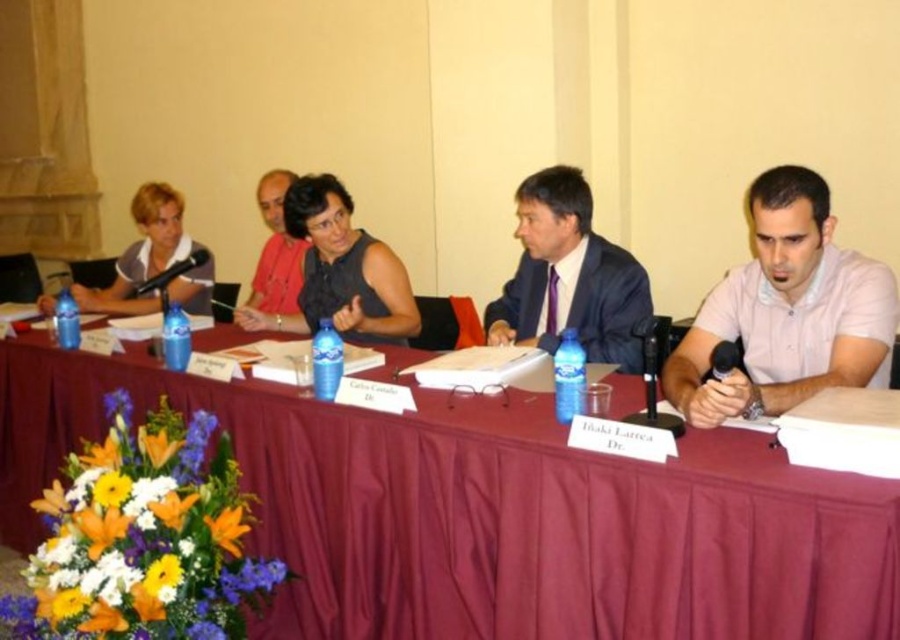
Question: Does maroon fabric table at center have a smaller size compared to matte black shirt at center?

Choices:
 (A) no
 (B) yes

Answer: (A)

Question: Is black matte dress at center in front of matte black shirt at left?

Choices:
 (A) no
 (B) yes

Answer: (B)

Question: Which point is farther to the camera?

Choices:
 (A) maroon fabric table at center
 (B) light pink cotton shirt at right
 (C) matte black suit at center
 (D) black matte dress at center

Answer: (D)

Question: Where is maroon fabric table at center located in relation to matte black shirt at left in the image?

Choices:
 (A) below
 (B) above

Answer: (A)

Question: Which point is farther to the camera?

Choices:
 (A) (790, 211)
 (B) (582, 296)
 (C) (202, 264)

Answer: (C)

Question: Estimate the real-world distances between objects in this image. Which object is closer to the matte black shirt at left?

Choices:
 (A) maroon fabric table at center
 (B) matte black shirt at center
 (C) light pink cotton shirt at right
 (D) matte black suit at center

Answer: (B)